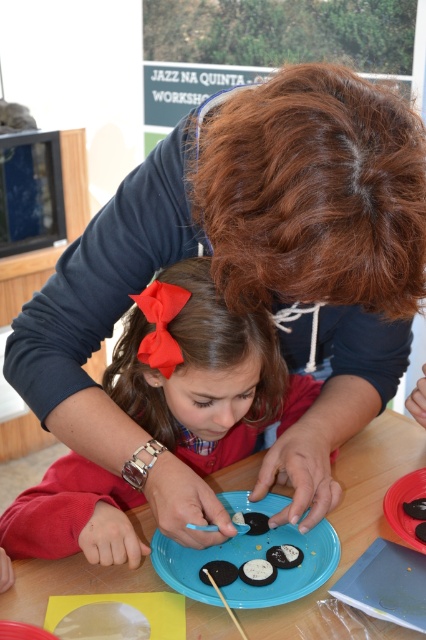
Question: Can you confirm if wooden table at center is positioned below black matte platter at center?

Choices:
 (A) yes
 (B) no

Answer: (A)

Question: Does blue matte plate at center have a smaller size compared to black matte platter at center?

Choices:
 (A) no
 (B) yes

Answer: (A)

Question: Estimate the real-world distances between objects in this image. Which object is closer to the wooden table at center?

Choices:
 (A) blue matte plate at center
 (B) black matte platter at center
 (C) matte red bow at center

Answer: (A)

Question: Which of the following is the closest to the observer?

Choices:
 (A) (270, 499)
 (B) (411, 474)
 (C) (80, 557)

Answer: (C)

Question: Can you confirm if matte red bow at center is positioned to the left of blue matte plate at center?

Choices:
 (A) no
 (B) yes

Answer: (B)

Question: Which object is farther from the camera taking this photo?

Choices:
 (A) blue matte plate at center
 (B) wooden table at center
 (C) matte red bow at center

Answer: (C)